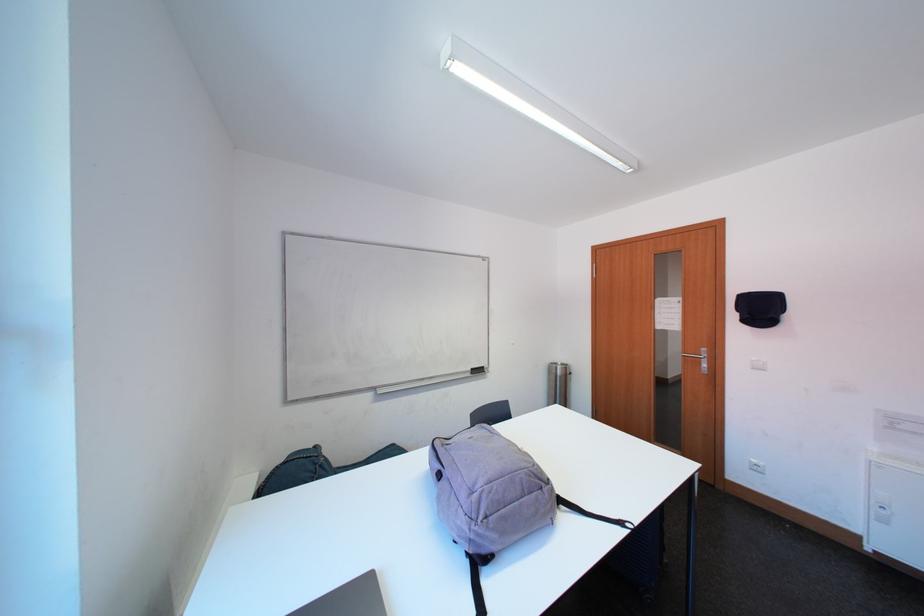
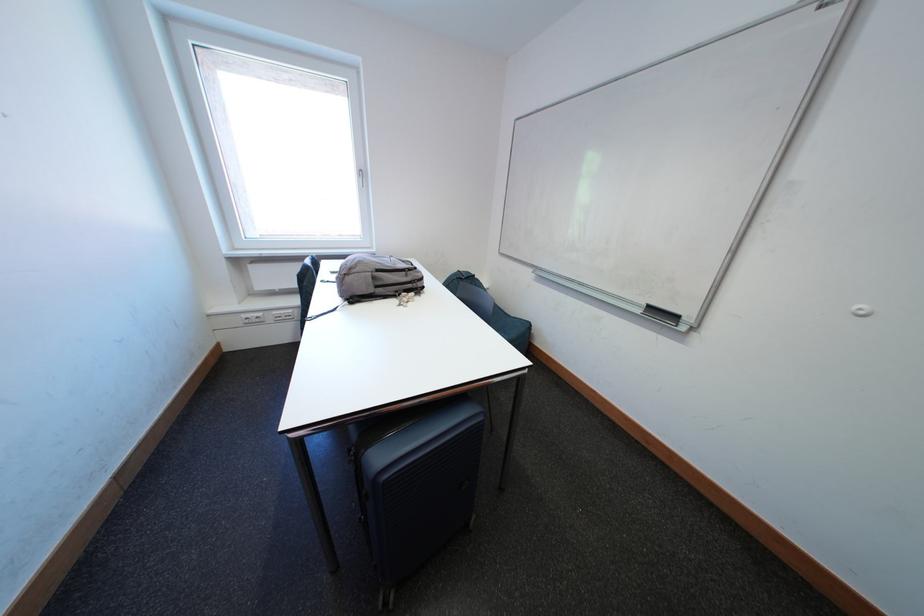
Where in the second image is the point corresponding to the point at 479,378 from the first image?

(649, 315)